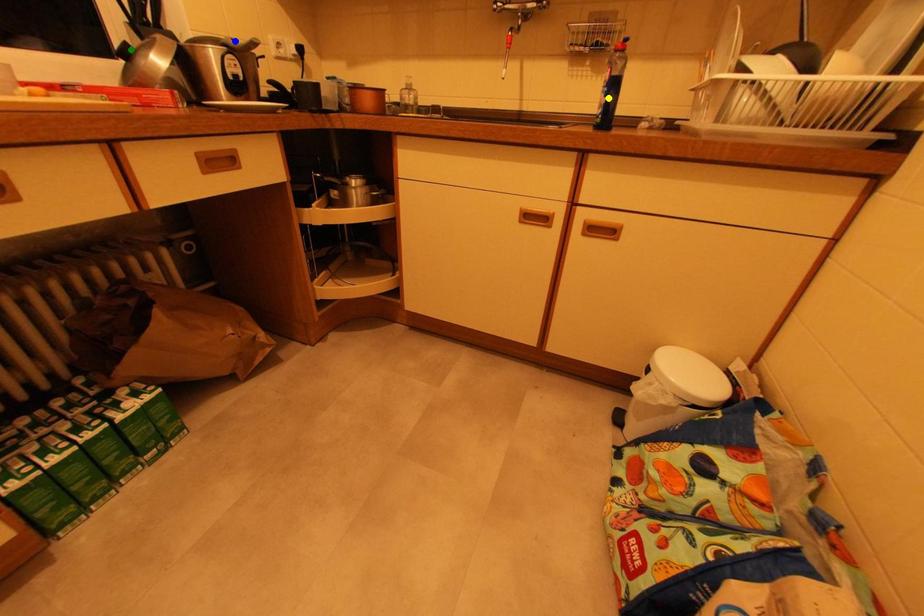
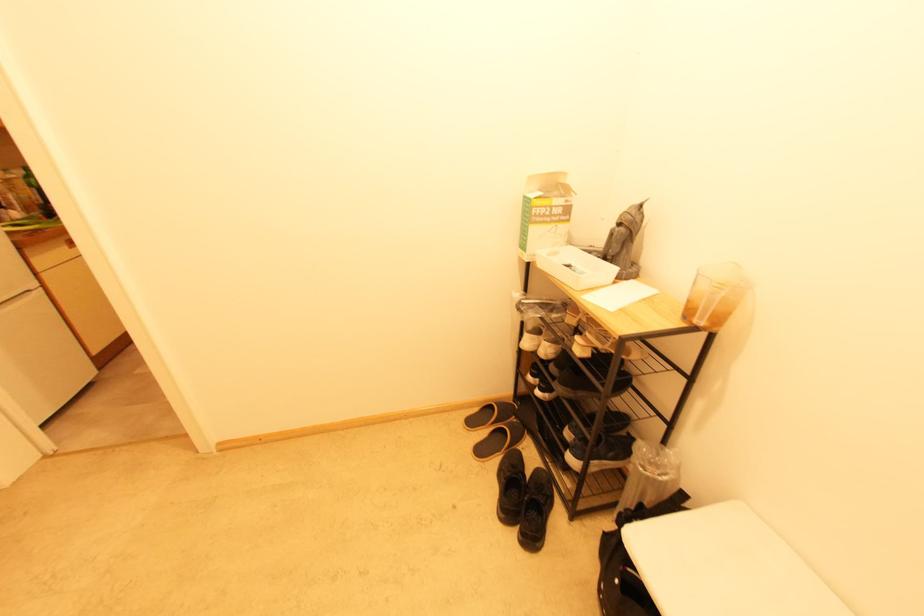
I am providing you with two images of the same scene from different viewpoints. Three points are marked in image1. Which point corresponds to a part or object that is occluded in image2?In image1, three points are marked. Which of them correspond to a part or object that is occluded in image2?Among the three points shown in image1, which one corresponds to a part or object that is no longer visible due to occlusion in image2?

Invisible in image2: yellow point, blue point, green point.